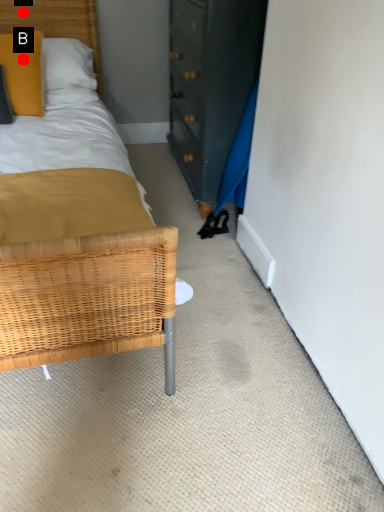
Question: Two points are circled on the image, labeled by A and B beside each circle. Which point is closer to the camera?

Choices:
 (A) A is closer
 (B) B is closer

Answer: (B)